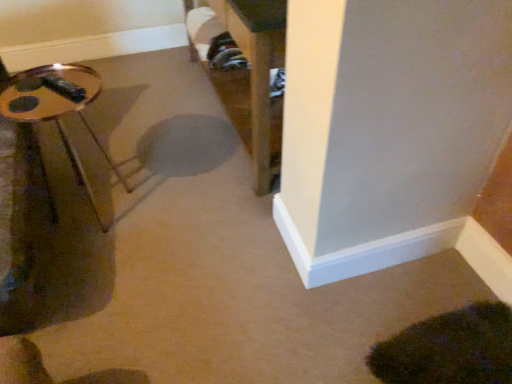
This screenshot has width=512, height=384. Find the location of `vacant area located to the right-hand side of metallic glass table at left`. vacant area located to the right-hand side of metallic glass table at left is located at coordinates (173, 206).